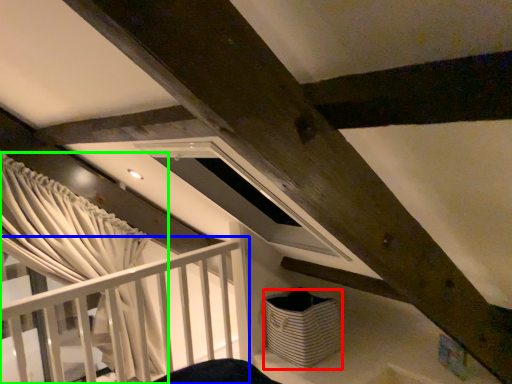
Question: Which is farther away from basket (highlighted by a red box)? rail (highlighted by a blue box) or curtain (highlighted by a green box)?

Choices:
 (A) rail
 (B) curtain

Answer: (B)